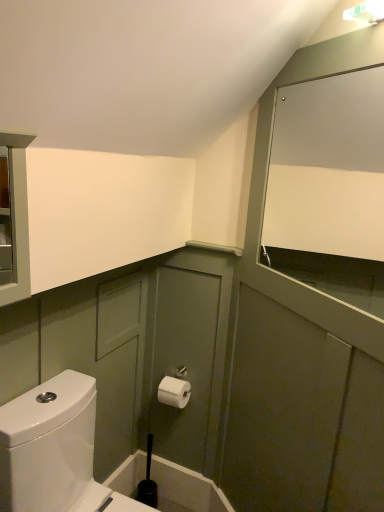
Question: Is white glossy toilet at lower left not close to white paper toilet paper at center?

Choices:
 (A) no
 (B) yes

Answer: (A)

Question: Is white paper toilet paper at center at the back of white glossy toilet at lower left?

Choices:
 (A) yes
 (B) no

Answer: (B)

Question: Considering the relative positions of white glossy toilet at lower left and white paper toilet paper at center in the image provided, is white glossy toilet at lower left to the left of white paper toilet paper at center from the viewer's perspective?

Choices:
 (A) no
 (B) yes

Answer: (B)

Question: From the image's perspective, is white glossy toilet at lower left above white paper toilet paper at center?

Choices:
 (A) no
 (B) yes

Answer: (A)

Question: Is white glossy toilet at lower left bigger than white paper toilet paper at center?

Choices:
 (A) no
 (B) yes

Answer: (B)

Question: Is point (362, 170) closer or farther from the camera than point (135, 463)?

Choices:
 (A) closer
 (B) farther

Answer: (A)

Question: Considering the positions of white matte cabinet at upper right and black plastic toilet brush at lower center in the image, is white matte cabinet at upper right bigger or smaller than black plastic toilet brush at lower center?

Choices:
 (A) big
 (B) small

Answer: (A)

Question: From the image's perspective, relative to black plastic toilet brush at lower center, is white matte cabinet at upper right above or below?

Choices:
 (A) above
 (B) below

Answer: (A)

Question: From a real-world perspective, is white matte cabinet at upper right physically located above or below black plastic toilet brush at lower center?

Choices:
 (A) above
 (B) below

Answer: (A)

Question: Is point (52, 464) closer or farther from the camera than point (130, 467)?

Choices:
 (A) closer
 (B) farther

Answer: (A)

Question: From their relative heights in the image, would you say white glossy toilet at lower left is taller or shorter than black plastic toilet brush at lower center?

Choices:
 (A) short
 (B) tall

Answer: (B)

Question: From the image's perspective, is white glossy toilet at lower left above or below black plastic toilet brush at lower center?

Choices:
 (A) below
 (B) above

Answer: (B)

Question: From a real-world perspective, is white glossy toilet at lower left above or below black plastic toilet brush at lower center?

Choices:
 (A) above
 (B) below

Answer: (A)

Question: Is black plastic toilet brush at lower center situated inside white matte cabinet at upper right or outside?

Choices:
 (A) outside
 (B) inside

Answer: (A)

Question: Looking at their shapes, would you say black plastic toilet brush at lower center is wider or thinner than white matte cabinet at upper right?

Choices:
 (A) wide
 (B) thin

Answer: (B)